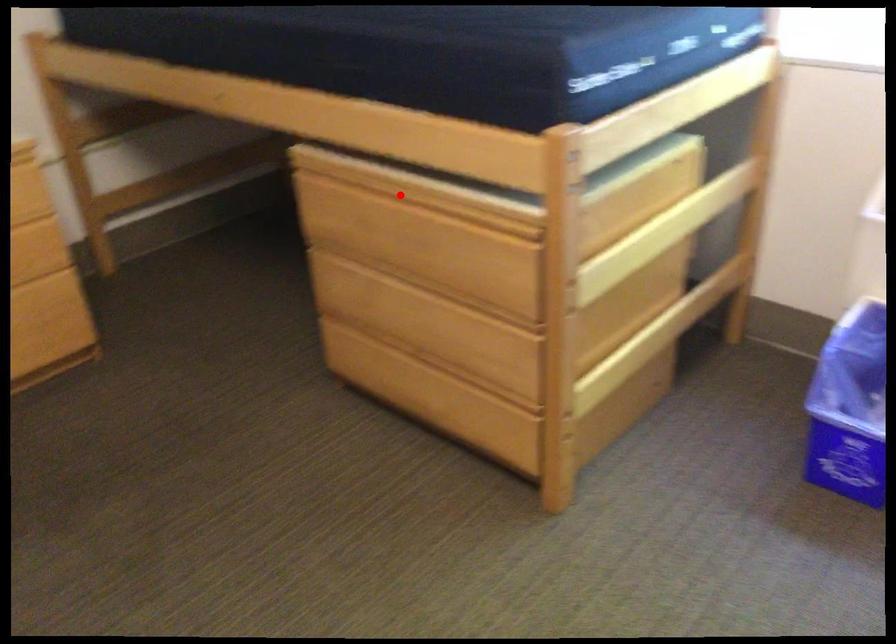
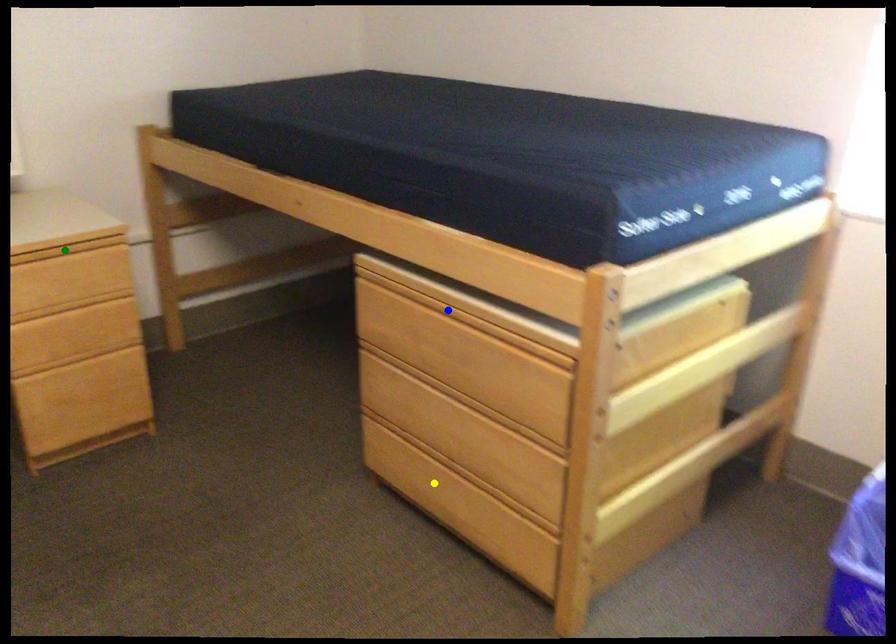
Question: I am providing you with two images of the same scene from different viewpoints. A red point is marked on the first image. You are given multiple points on the second image. Which mark in image 2 goes with the point in image 1?

Choices:
 (A) blue point
 (B) green point
 (C) yellow point

Answer: (A)